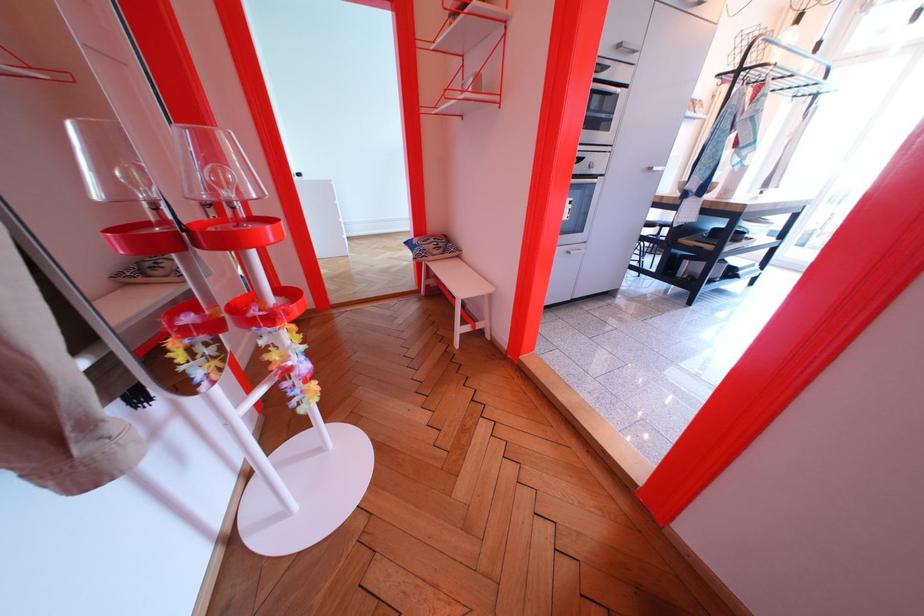
Find the location of `patterned cushion`. patterned cushion is located at coordinates (431, 246).